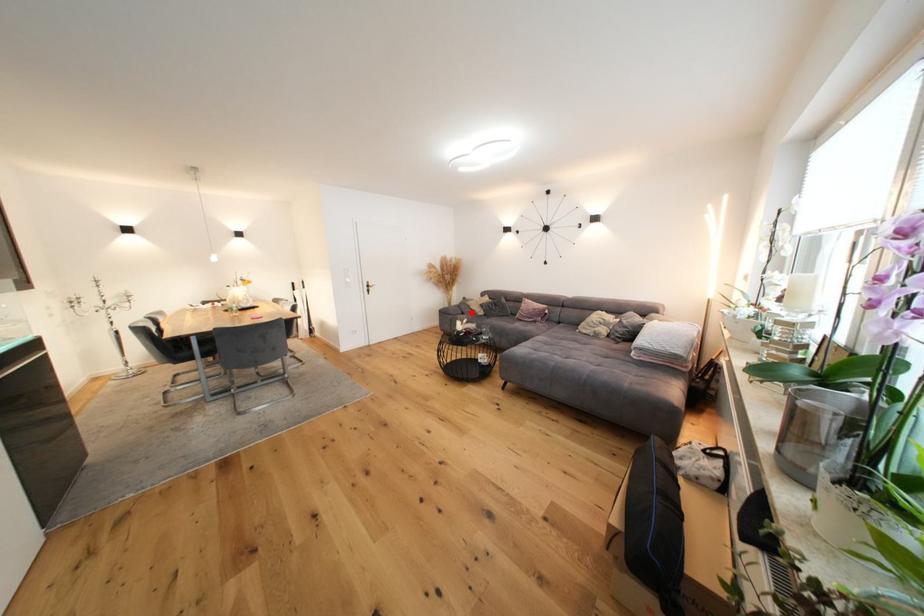
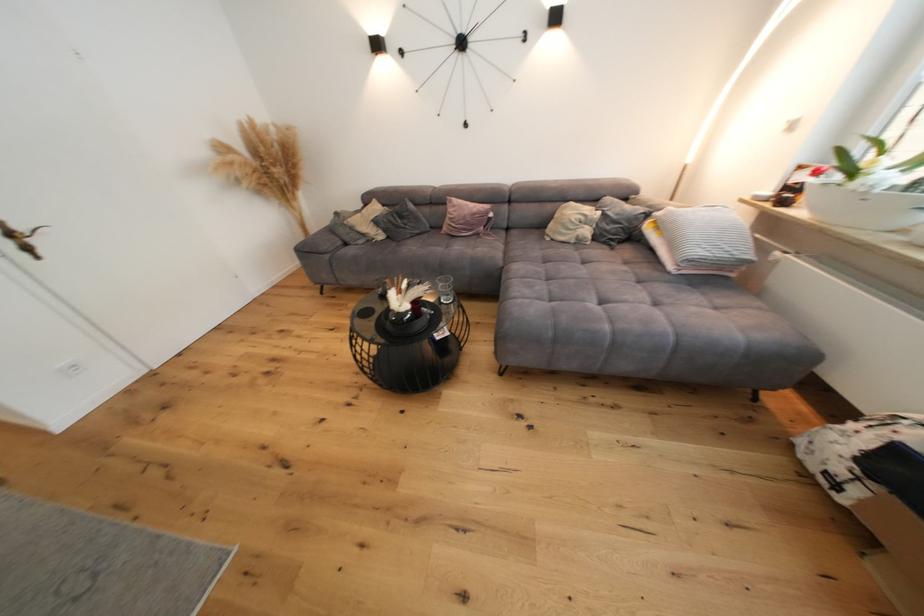
Find the pixel in the second image that matches the highlighted location in the first image.

(354, 240)